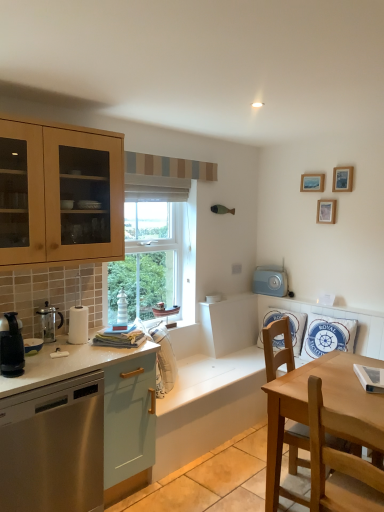
Image resolution: width=384 pixels, height=512 pixels. Find the location of `white striped lighthouse at window, which is counted as the 1th appliance, starting from the left`. white striped lighthouse at window, which is counted as the 1th appliance, starting from the left is located at coordinates (121, 311).

Measure the distance between point (119, 324) and camera.

10.46 feet.

This screenshot has height=512, width=384. Describe the element at coordinates (312, 183) in the screenshot. I see `wooden picture frame at upper right, positioned as the 3th picture frame in bottom-to-top order` at that location.

Image resolution: width=384 pixels, height=512 pixels. What do you see at coordinates (49, 322) in the screenshot?
I see `transparent glass coffee maker at left, positioned as the 2th kitchen appliance in front-to-back order` at bounding box center [49, 322].

How much space does transparent glass coffee maker at left, positioned as the 2th kitchen appliance in front-to-back order, occupy horizontally?

It is 11.83 centimeters.

Where is `white fabric pillow at center, the second appliance when ordered from right to left`? The height and width of the screenshot is (512, 384). white fabric pillow at center, the second appliance when ordered from right to left is located at coordinates (164, 360).

You are a GUI agent. You are given a task and a screenshot of the screen. Output one action in this format:
    pyautogui.click(x=<x>, y=<y>)
    Task: Click on the wooden chair at lower right, positioned as the 2th chair in front-to-back order
    The image size is (384, 512).
    Given the screenshot: What is the action you would take?
    pyautogui.click(x=279, y=351)

Considering the sizes of objects wooden picture frame at upper right, positioned as the 3th picture frame in bottom-to-top order, and wooden picture frame at upper right, placed as the 2th picture frame when sorted from top to bottom, in the image provided, who is smaller, wooden picture frame at upper right, positioned as the 3th picture frame in bottom-to-top order, or wooden picture frame at upper right, placed as the 2th picture frame when sorted from top to bottom,?

Smaller between the two is wooden picture frame at upper right, placed as the 2th picture frame when sorted from top to bottom.

Which of these two, wooden picture frame at upper right, arranged as the first picture frame when viewed from the top, or wooden picture frame at upper right, placed as the 2th picture frame when sorted from top to bottom, is thinner?

wooden picture frame at upper right, placed as the 2th picture frame when sorted from top to bottom.

How far apart are wooden picture frame at upper right, positioned as the 3th picture frame in bottom-to-top order, and wooden picture frame at upper right, placed as the 2th picture frame when sorted from top to bottom?

A distance of 7.65 inches exists between wooden picture frame at upper right, positioned as the 3th picture frame in bottom-to-top order, and wooden picture frame at upper right, placed as the 2th picture frame when sorted from top to bottom.

From the image's perspective, is wooden picture frame at upper right, positioned as the 3th picture frame in bottom-to-top order, over wooden picture frame at upper right, placed as the 2th picture frame when sorted from top to bottom?

Yes, from the image's perspective, wooden picture frame at upper right, positioned as the 3th picture frame in bottom-to-top order, is above wooden picture frame at upper right, placed as the 2th picture frame when sorted from top to bottom.

Who is more distant, blue fabric pillow at right, the 1th pillow when ordered from right to left, or white glossy countertop at lower left?

blue fabric pillow at right, the 1th pillow when ordered from right to left, is further from the camera.

Is blue fabric pillow at right, the 1th pillow when ordered from right to left, turned away from white glossy countertop at lower left?

No, white glossy countertop at lower left is not at the back of blue fabric pillow at right, the 1th pillow when ordered from right to left.

In the scene shown: Is blue fabric pillow at right, the 1th pillow when ordered from right to left, smaller than white glossy countertop at lower left?

Indeed, blue fabric pillow at right, the 1th pillow when ordered from right to left, has a smaller size compared to white glossy countertop at lower left.

Is blue fabric pillow at right, the 1th pillow when ordered from right to left, spatially inside white glossy countertop at lower left, or outside of it?

blue fabric pillow at right, the 1th pillow when ordered from right to left, is located beyond the bounds of white glossy countertop at lower left.

Considering the sizes of white glossy countertop at lower left and wooden chair at lower right, positioned as the 2th chair in front-to-back order, in the image, is white glossy countertop at lower left taller or shorter than wooden chair at lower right, positioned as the 2th chair in front-to-back order,?

In the image, white glossy countertop at lower left appears to be shorter than wooden chair at lower right, positioned as the 2th chair in front-to-back order.

Can you tell me how much white glossy countertop at lower left and wooden chair at lower right, placed as the first chair when sorted from back to front, differ in facing direction?

There is a 15.8-degree angle between the facing directions of white glossy countertop at lower left and wooden chair at lower right, placed as the first chair when sorted from back to front.

From the image's perspective, is white glossy countertop at lower left beneath wooden chair at lower right, positioned as the 2th chair in front-to-back order?

Yes.

Looking at this image, considering the positions of objects black plastic coffee maker at left, arranged as the second kitchen appliance when viewed from the back, and white fabric pillow at center, the second appliance when ordered from right to left, in the image provided, who is more to the right, black plastic coffee maker at left, arranged as the second kitchen appliance when viewed from the back, or white fabric pillow at center, the second appliance when ordered from right to left,?

white fabric pillow at center, the second appliance when ordered from right to left.

Considering the sizes of objects black plastic coffee maker at left, arranged as the second kitchen appliance when viewed from the back, and white fabric pillow at center, the first appliance from the front, in the image provided, who is bigger, black plastic coffee maker at left, arranged as the second kitchen appliance when viewed from the back, or white fabric pillow at center, the first appliance from the front,?

white fabric pillow at center, the first appliance from the front, is bigger.

From the image's perspective, does black plastic coffee maker at left, arranged as the second kitchen appliance when viewed from the back, appear lower than white fabric pillow at center, the first appliance from the front?

Incorrect, from the image's perspective, black plastic coffee maker at left, arranged as the second kitchen appliance when viewed from the back, is higher than white fabric pillow at center, the first appliance from the front.

Can you tell me how much black plastic coffee maker at left, arranged as the second kitchen appliance when viewed from the back, and white fabric pillow at center, the second appliance when ordered from right to left, differ in facing direction?

black plastic coffee maker at left, arranged as the second kitchen appliance when viewed from the back, and white fabric pillow at center, the second appliance when ordered from right to left, are facing 41.4 degrees away from each other.

Is blue fabric pillow at right, acting as the second pillow starting from the left, outside of white fabric pillow at right, which ranks as the 1th pillow in left-to-right order?

blue fabric pillow at right, acting as the second pillow starting from the left, is positioned outside white fabric pillow at right, which ranks as the 1th pillow in left-to-right order.

Looking at this image, considering the relative sizes of blue fabric pillow at right, acting as the second pillow starting from the left, and white fabric pillow at right, acting as the second pillow starting from the right, in the image provided, is blue fabric pillow at right, acting as the second pillow starting from the left, smaller than white fabric pillow at right, acting as the second pillow starting from the right,?

Correct, blue fabric pillow at right, acting as the second pillow starting from the left, occupies less space than white fabric pillow at right, acting as the second pillow starting from the right.

From a real-world perspective, relative to white fabric pillow at right, acting as the second pillow starting from the right, is blue fabric pillow at right, acting as the second pillow starting from the left, vertically above or below?

Clearly, from a real-world perspective, blue fabric pillow at right, acting as the second pillow starting from the left, is above white fabric pillow at right, acting as the second pillow starting from the right.

From a real-world perspective, starting from the transparent glass coffee maker at left, positioned as the 2th kitchen appliance in front-to-back order, which picture frame is the 3rd one vertically above it? Please provide its 2D coordinates.

[(342, 179)]

Is transparent glass coffee maker at left, positioned as the 2th kitchen appliance in front-to-back order, bigger than wooden picture frame at upper right, the second picture frame ordered from the bottom?

Yes, transparent glass coffee maker at left, positioned as the 2th kitchen appliance in front-to-back order, is bigger than wooden picture frame at upper right, the second picture frame ordered from the bottom.

Is point (39, 314) farther from camera compared to point (347, 180)?

No, (39, 314) is in front of (347, 180).

From the image's perspective, which object appears higher, transparent glass coffee maker at left, positioned as the 2th kitchen appliance in front-to-back order, or wooden picture frame at upper right, the second picture frame ordered from the bottom?

wooden picture frame at upper right, the second picture frame ordered from the bottom, from the image's perspective.

Does white glossy countertop at lower left have a greater height compared to white striped lighthouse at window, which is counted as the 1th appliance, starting from the left?

Indeed, white glossy countertop at lower left has a greater height compared to white striped lighthouse at window, which is counted as the 1th appliance, starting from the left.

From the image's perspective, which is above, white glossy countertop at lower left or white striped lighthouse at window, which is counted as the 1th appliance, starting from the left?

white striped lighthouse at window, which is counted as the 1th appliance, starting from the left, is shown above in the image.

Locate an element on the screen. picture frame located above the wooden picture frame at upper right, the second picture frame ordered from the bottom (from the image's perspective) is located at coordinates (312, 183).

From a real-world perspective, count 2nd pillows upward from the white glossy countertop at lower left and point to it. Please provide its 2D coordinates.

[(327, 336)]

Looking at the image, which one is located closer to wooden chair at lower right, the second chair positioned from the back, blue fabric pillow at right, acting as the second pillow starting from the left, or wooden picture frame at upper right, arranged as the third picture frame when viewed from the top?

blue fabric pillow at right, acting as the second pillow starting from the left, lies closer to wooden chair at lower right, the second chair positioned from the back, than the other object.

When comparing their distances from stainless steel dishwasher at left, does transparent glass coffee maker at left, positioned as the 2th kitchen appliance in front-to-back order, or white glossy countertop at lower left seem further?

Based on the image, transparent glass coffee maker at left, positioned as the 2th kitchen appliance in front-to-back order, appears to be further to stainless steel dishwasher at left.

When comparing their distances from wooden chair at lower right, the 1th chair positioned from the front, does wooden picture frame at upper right, arranged as the third picture frame when viewed from the top, or blue fabric pillow at right, the 1th pillow when ordered from right to left, seem further?

The object further to wooden chair at lower right, the 1th chair positioned from the front, is wooden picture frame at upper right, arranged as the third picture frame when viewed from the top.

From the picture: Which object lies further to the anchor point white fabric pillow at right, which ranks as the 1th pillow in left-to-right order, light blue plastic toaster at upper right, which is the first appliance in back-to-front order, or wooden picture frame at upper right, placed as the first picture frame when sorted from bottom to top?

wooden picture frame at upper right, placed as the first picture frame when sorted from bottom to top, is positioned further to the anchor white fabric pillow at right, which ranks as the 1th pillow in left-to-right order.

Estimate the real-world distances between objects in this image. Which object is further from wooden picture frame at upper right, arranged as the third picture frame when viewed from the top, white fabric pillow at center, the first appliance from the front, or stainless steel dishwasher at left?

stainless steel dishwasher at left.

When comparing their distances from wooden picture frame at upper right, placed as the first picture frame when sorted from bottom to top, does wooden chair at lower right, placed as the first chair when sorted from back to front, or wooden chair at lower right, the second chair positioned from the back, seem closer?

wooden chair at lower right, placed as the first chair when sorted from back to front, is closer to wooden picture frame at upper right, placed as the first picture frame when sorted from bottom to top.

In the scene shown: Considering their positions, is wooden picture frame at upper right, placed as the 2th picture frame when sorted from top to bottom, positioned further to blue fabric pillow at right, the 1th pillow when ordered from right to left, than white glossy countertop at lower left?

The object further to blue fabric pillow at right, the 1th pillow when ordered from right to left, is white glossy countertop at lower left.

Consider the image. Considering their positions, is transparent glass coffee maker at left, positioned as the 2th kitchen appliance in front-to-back order, positioned further to white striped lighthouse at window, which is the third appliance in right-to-left order, than wooden chair at lower right, positioned as the 2th chair in front-to-back order?

wooden chair at lower right, positioned as the 2th chair in front-to-back order.

The image size is (384, 512). In order to click on kitchen appliance between black plastic coffee maker at left, the 1th kitchen appliance from the front, and blue fabric pillow at right, acting as the second pillow starting from the left, in the horizontal direction in this screenshot , I will do `click(49, 322)`.

Locate an element on the screen. dishwasher between black plastic coffee maker at left, arranged as the second kitchen appliance when viewed from the back, and wooden chair at lower right, the second chair positioned from the back, from left to right is located at coordinates (53, 447).

The width and height of the screenshot is (384, 512). I want to click on countertop situated between transparent glass coffee maker at left, positioned as the 2th kitchen appliance in front-to-back order, and wooden picture frame at upper right, positioned as the 3th picture frame in bottom-to-top order, from left to right, so click(70, 424).

The width and height of the screenshot is (384, 512). Identify the location of pillow between wooden picture frame at upper right, the second picture frame ordered from the bottom, and white fabric pillow at right, acting as the second pillow starting from the right, in the vertical direction. (327, 336).